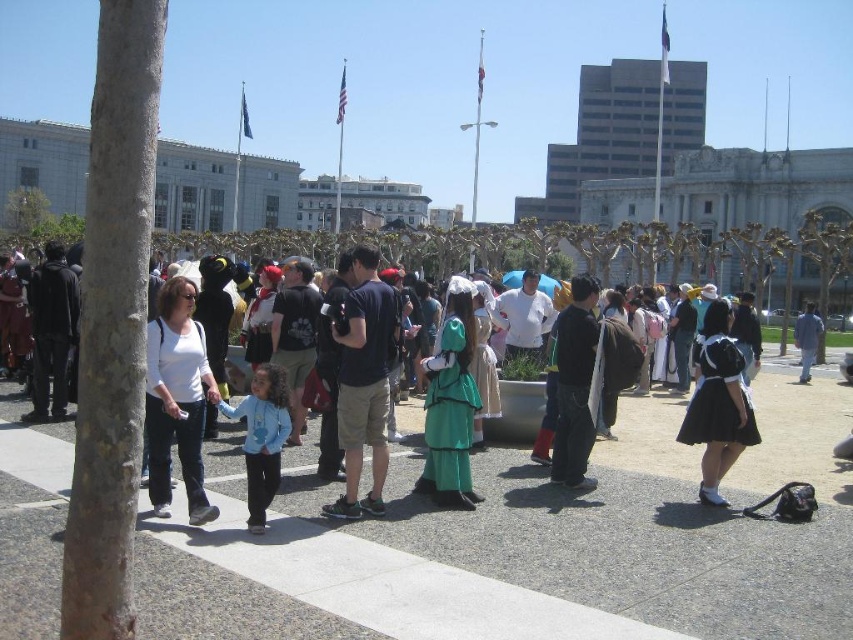
Question: Which object is the closest to the light blue fleece jacket at center?

Choices:
 (A) dark gray fabric coat at left
 (B) blue denim jeans at right
 (C) satin black dress at center
 (D) dark blue t-shirt at center

Answer: (D)

Question: Is satin black dress at center thinner than blue denim jeans at right?

Choices:
 (A) no
 (B) yes

Answer: (B)

Question: Which of these objects is positioned farthest from the white matte shirt at center?

Choices:
 (A) green satin dress at center
 (B) satin black dress at center
 (C) green fabric dress at center

Answer: (B)

Question: Does white matte shirt at center appear over black matte jacket at center?

Choices:
 (A) no
 (B) yes

Answer: (A)

Question: Where is light blue fleece jacket at center located in relation to green fabric dress at center in the image?

Choices:
 (A) left
 (B) right

Answer: (B)

Question: Which point is closer to the camera?

Choices:
 (A) (590, 307)
 (B) (740, 371)
 (C) (277, 451)

Answer: (C)